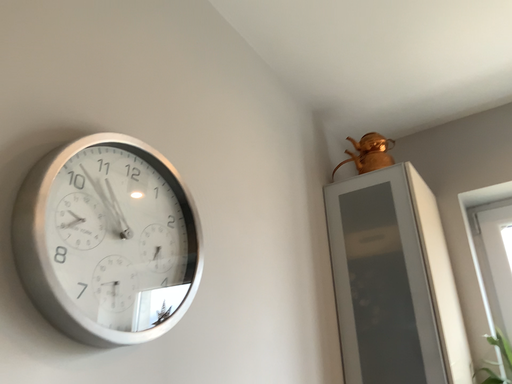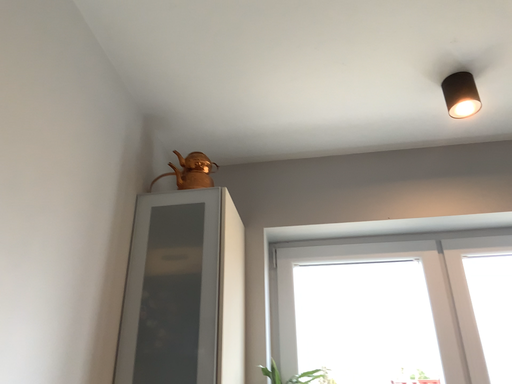
Question: Which way did the camera rotate in the video?

Choices:
 (A) rotated left
 (B) rotated right

Answer: (B)